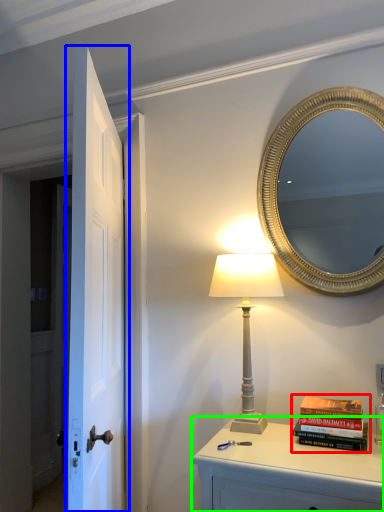
Question: Based on their relative distances, which object is nearer to book (highlighted by a red box)? Choose from door (highlighted by a blue box) and nightstand (highlighted by a green box).

Choices:
 (A) door
 (B) nightstand

Answer: (B)